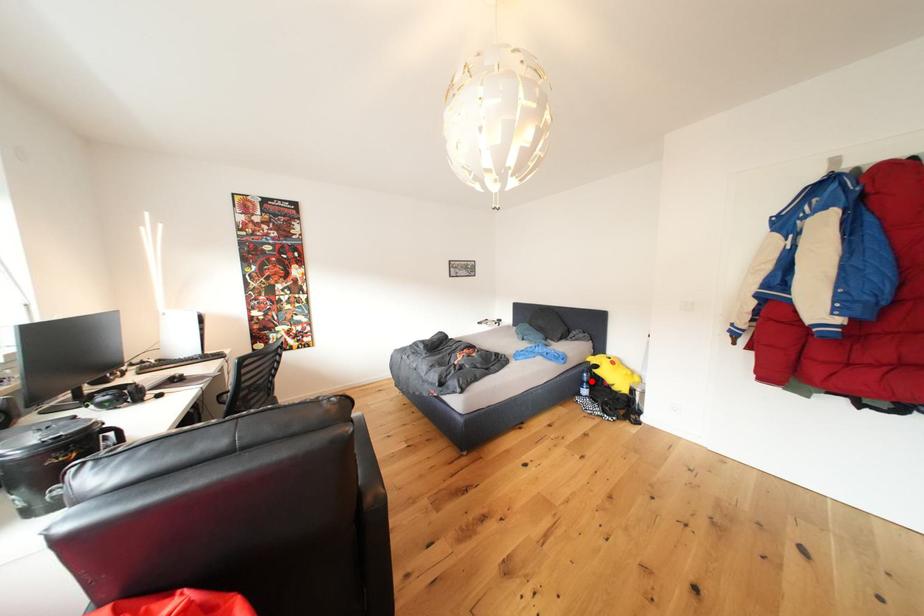
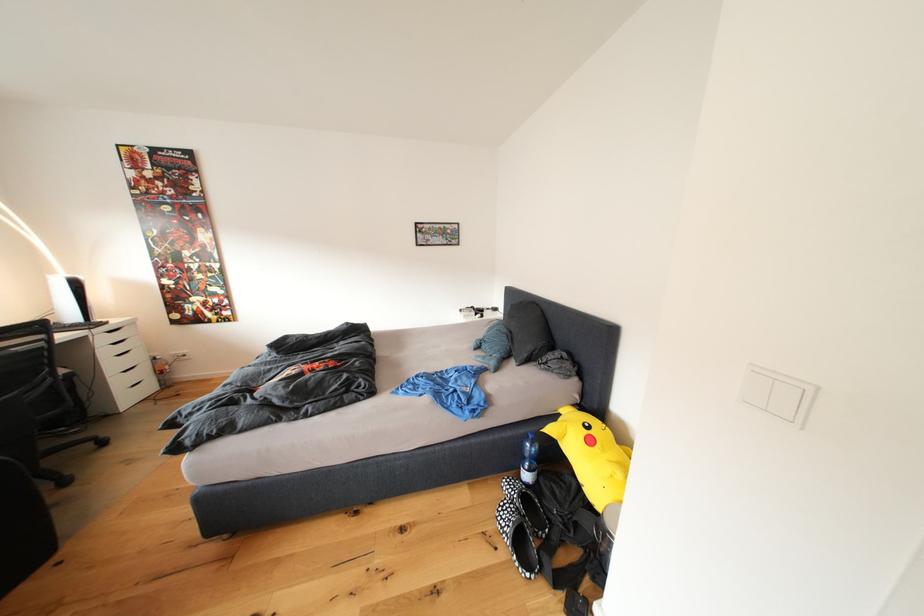
Question: I am providing you with two images of the same scene from different viewpoints. In image1, a red point is highlighted. Considering the same 3D point in image2, which of the following is correct?

Choices:
 (A) It is closer
 (B) It is farther

Answer: (A)